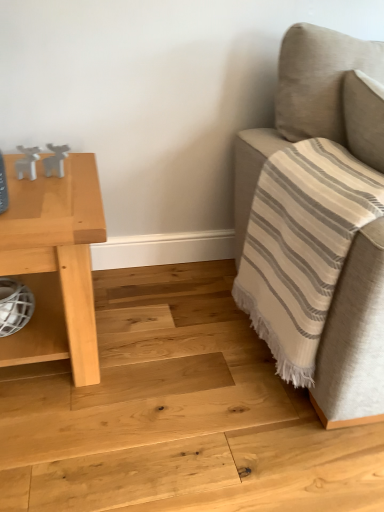
The image size is (384, 512). What are the coordinates of `free location to the right of light wood table at left` in the screenshot? It's located at (170, 347).